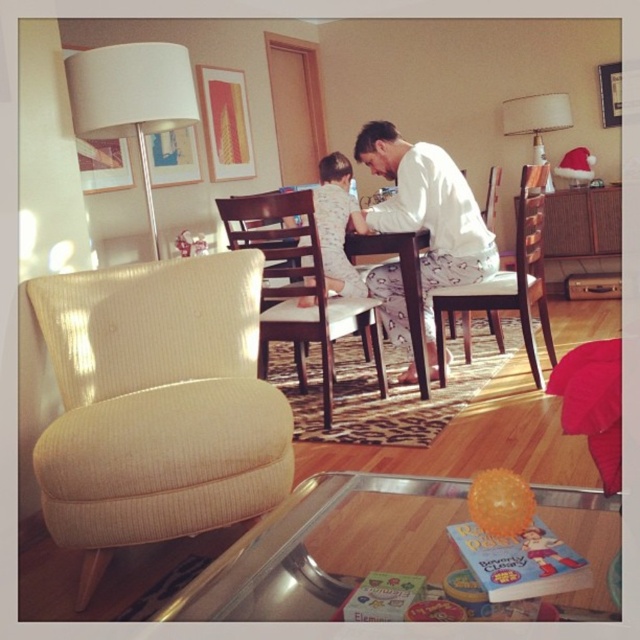
You are standing in the living room and want to pick up an item from the coffee table. There are two points marked on the table, point (410,227) and point (509,276). Which point is closer to you?

Point (410,227) is closer to the viewer than point (509,276).

You are standing in the living room and want to place a 36 inch long decorative item on the transparent glass table at lower center. Can the table accommodate the item?

The transparent glass table at lower center is 34.27 inches away from viewer. However, the question is about the table accommodating a 36 inch long item. The description only provides the distance from the viewer, not the table dimensions. Therefore, insufficient information is provided to determine if the item will fit.

You are organizing a closet and have two items on the table in front of you, the white cotton shirt at center and the white pajama at center. Which item has a larger width?

The white cotton shirt at center has a larger width than the white pajama at center.